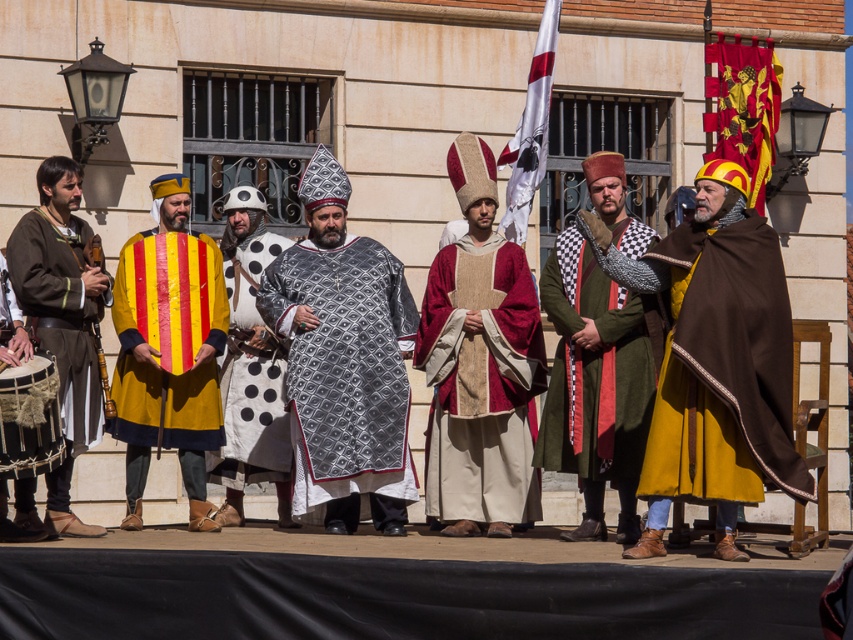
Consider the image. Which is below, yellowstriped fabricshield at left or brown leather tunic at left?

yellowstriped fabricshield at left is lower down.

Is point (137, 262) in front of point (93, 364)?

No, it is not.

The height and width of the screenshot is (640, 853). In order to click on yellowstriped fabricshield at left in this screenshot , I will do `click(167, 349)`.

Can you confirm if red velvet robe at center is wider than white fabric flag at center?

Yes.

Is red velvet robe at center taller than white fabric flag at center?

No.

Between point (523, 355) and point (554, 17), which one is positioned in front?

Point (523, 355) is more forward.

Locate an element on the screen. This screenshot has width=853, height=640. red velvet robe at center is located at coordinates (480, 381).

Can you confirm if brown woolen cape at center is wider than wooden flute at left?

Indeed, brown woolen cape at center has a greater width compared to wooden flute at left.

Looking at this image, is brown woolen cape at center to the right of wooden flute at left from the viewer's perspective?

Indeed, brown woolen cape at center is positioned on the right side of wooden flute at left.

Locate an element on the screen. This screenshot has width=853, height=640. brown woolen cape at center is located at coordinates (714, 358).